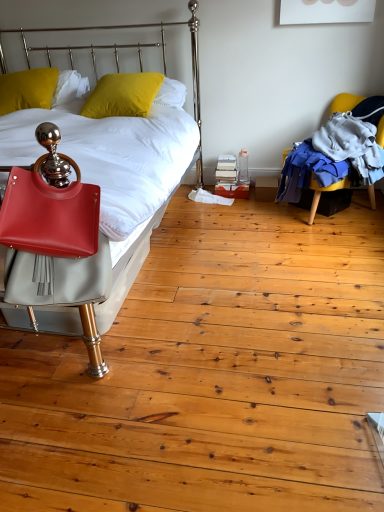
Question: Is matte leather bed at left far away from yellow matte pillow at upper left, which is the second pillow in right-to-left order?

Choices:
 (A) no
 (B) yes

Answer: (B)

Question: Is matte leather bed at left further to the viewer compared to yellow matte pillow at upper left, which is the second pillow in right-to-left order?

Choices:
 (A) no
 (B) yes

Answer: (A)

Question: Is matte leather bed at left thinner than yellow matte pillow at upper left, which is counted as the 1th pillow, starting from the left?

Choices:
 (A) yes
 (B) no

Answer: (B)

Question: From the image's perspective, is matte leather bed at left on top of yellow matte pillow at upper left, which is the second pillow in right-to-left order?

Choices:
 (A) no
 (B) yes

Answer: (A)

Question: Is matte leather bed at left next to yellow matte pillow at upper left, which is counted as the 1th pillow, starting from the left, and touching it?

Choices:
 (A) yes
 (B) no

Answer: (B)

Question: Considering the relative sizes of matte leather bed at left and yellow matte pillow at upper left, which is the second pillow in right-to-left order, in the image provided, is matte leather bed at left bigger than yellow matte pillow at upper left, which is the second pillow in right-to-left order,?

Choices:
 (A) yes
 (B) no

Answer: (A)

Question: Would you say matte leather bed at left is a long distance from yellow matte pillow at upper left, which is the first pillow in right-to-left order?

Choices:
 (A) yes
 (B) no

Answer: (A)

Question: Is matte leather bed at left positioned with its back to yellow matte pillow at upper left, the 2th pillow viewed from the left?

Choices:
 (A) no
 (B) yes

Answer: (B)

Question: Is the depth of matte leather bed at left greater than that of yellow matte pillow at upper left, the 2th pillow viewed from the left?

Choices:
 (A) no
 (B) yes

Answer: (A)

Question: Can you confirm if matte leather bed at left is taller than yellow matte pillow at upper left, the 2th pillow viewed from the left?

Choices:
 (A) no
 (B) yes

Answer: (B)

Question: Does matte leather bed at left contain yellow matte pillow at upper left, which is the first pillow in right-to-left order?

Choices:
 (A) yes
 (B) no

Answer: (A)

Question: Is matte leather bed at left wider than yellow matte pillow at upper left, which is the first pillow in right-to-left order?

Choices:
 (A) no
 (B) yes

Answer: (B)

Question: Considering the relative sizes of yellow fabric chair at right and matte leather bed at left in the image provided, is yellow fabric chair at right thinner than matte leather bed at left?

Choices:
 (A) no
 (B) yes

Answer: (B)